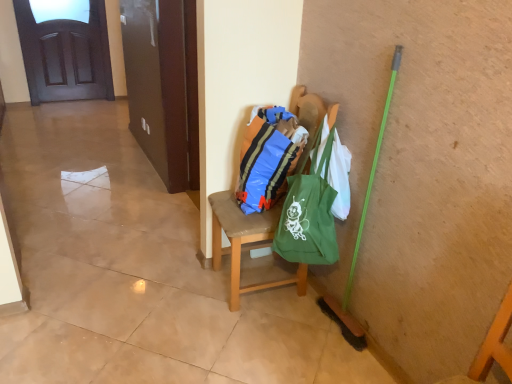
Identify the location of space that is in front of dark wood door at upper left. This screenshot has height=384, width=512. (65, 109).